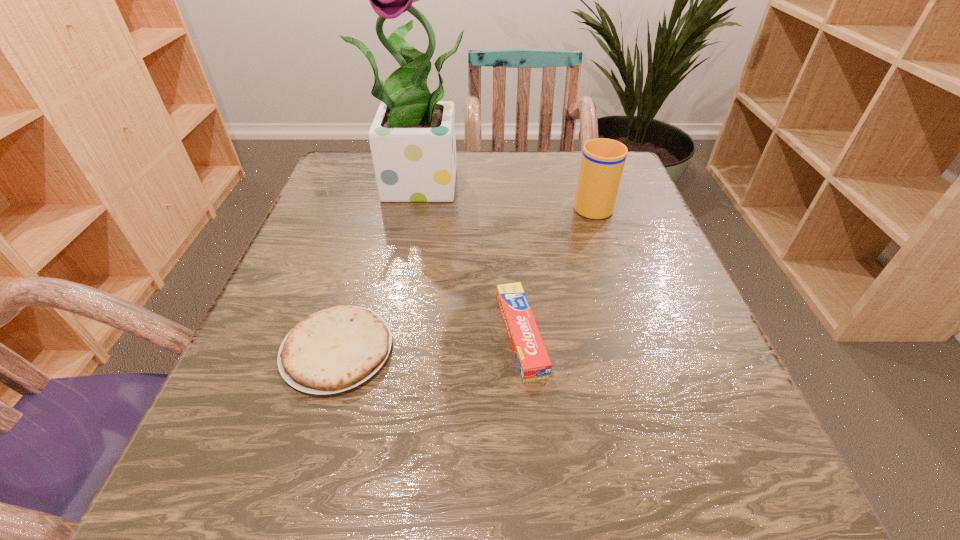
Identify the location of the tallest object. Image resolution: width=960 pixels, height=540 pixels. (412, 139).

Where is `cup`? This screenshot has width=960, height=540. cup is located at coordinates (602, 163).

Locate an element on the screen. This screenshot has width=960, height=540. the second tallest object is located at coordinates (602, 163).

Where is `toothpaste`? This screenshot has height=540, width=960. toothpaste is located at coordinates (530, 353).

Find the location of a particular element. The width and height of the screenshot is (960, 540). the third tallest object is located at coordinates (530, 353).

At what (x,y) coordinates should I click in order to perform the action: click on the shortest object. Please return your answer as a coordinate pair (x, y). This screenshot has height=540, width=960. Looking at the image, I should click on (336, 349).

Image resolution: width=960 pixels, height=540 pixels. What are the coordinates of `vacant region located on the front-facing side of the tallest object` in the screenshot? It's located at (401, 349).

Where is `vacant space located on the side of the third shortest object with the handle`? The width and height of the screenshot is (960, 540). vacant space located on the side of the third shortest object with the handle is located at coordinates (578, 161).

I want to click on vacant region located on the side of the third shortest object with the handle, so click(577, 159).

Find the location of a particular element. free location located on the side of the third shortest object with the handle is located at coordinates (578, 164).